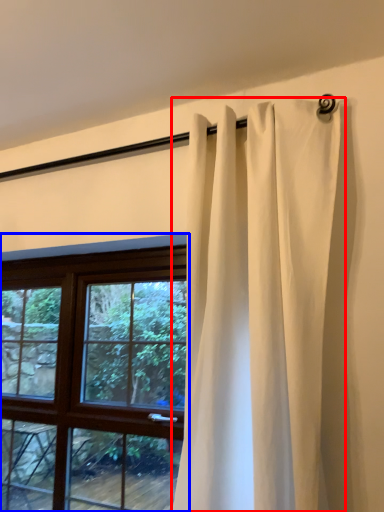
Question: Which object is further to the camera taking this photo, curtain (highlighted by a red box) or window (highlighted by a blue box)?

Choices:
 (A) curtain
 (B) window

Answer: (B)